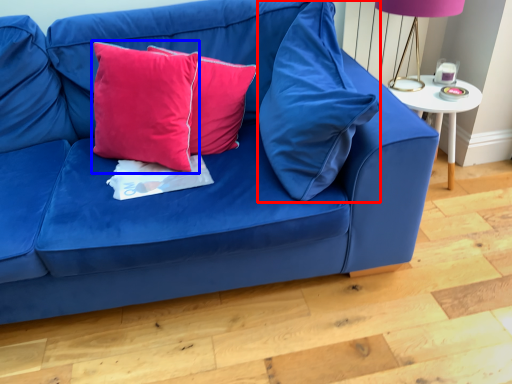
Question: Which of the following is the farthest to the observer, pillow (highlighted by a red box) or pillow (highlighted by a blue box)?

Choices:
 (A) pillow
 (B) pillow

Answer: (B)